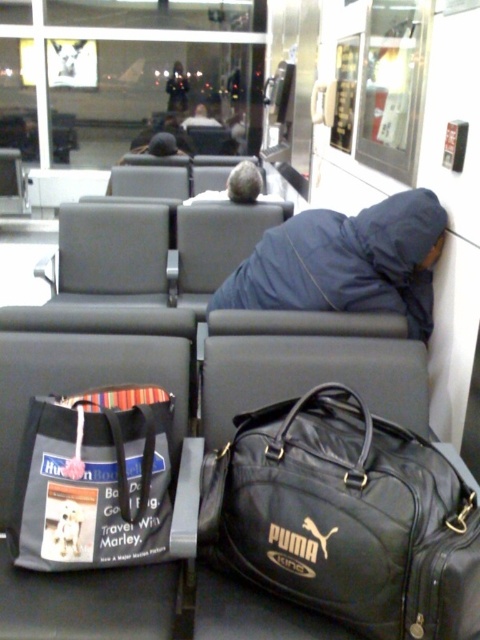
Is the position of black leather duffel at center more distant than that of gray fabric tote bag at lower left?

No, black leather duffel at center is in front of gray fabric tote bag at lower left.

Is black leather duffel at center bigger than gray fabric tote bag at lower left?

Indeed, black leather duffel at center has a larger size compared to gray fabric tote bag at lower left.

Does point (382, 548) come behind point (147, 560)?

No, it is in front of (147, 560).

At what (x,y) coordinates should I click in order to perform the action: click on black leather duffel at center. Please return your answer as a coordinate pair (x, y). Image resolution: width=480 pixels, height=640 pixels. Looking at the image, I should click on (345, 518).

Does gray fabric tote bag at lower left have a lesser width compared to blue fabric person at center?

Correct, gray fabric tote bag at lower left's width is less than blue fabric person at center's.

Can you confirm if gray fabric tote bag at lower left is bigger than blue fabric person at center?

No, gray fabric tote bag at lower left is not bigger than blue fabric person at center.

Does point (56, 449) come behind point (403, 294)?

No, it is not.

What are the coordinates of `gray fabric tote bag at lower left` in the screenshot? It's located at (94, 480).

Does black leather duffel at center appear on the left side of blue fabric person at center?

Incorrect, black leather duffel at center is not on the left side of blue fabric person at center.

Does black leather duffel at center have a lesser width compared to blue fabric person at center?

Yes.

This screenshot has height=640, width=480. What do you see at coordinates (345, 518) in the screenshot?
I see `black leather duffel at center` at bounding box center [345, 518].

In order to click on black leather duffel at center in this screenshot , I will do `click(345, 518)`.